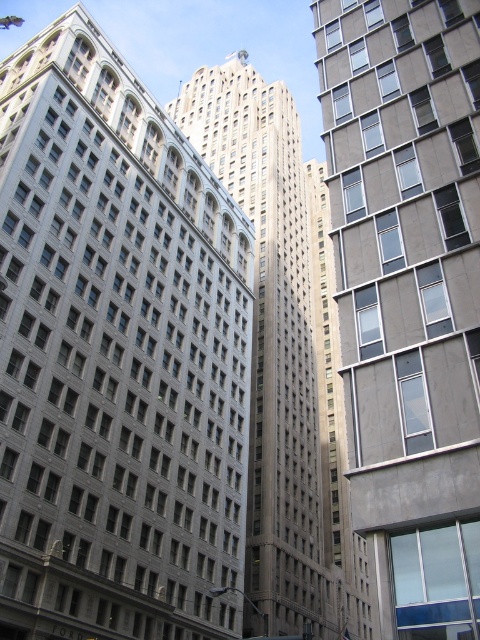
Question: Considering the relative positions of gray stone building at center and gray stone skyscraper at center in the image provided, where is gray stone building at center located with respect to gray stone skyscraper at center?

Choices:
 (A) above
 (B) below

Answer: (B)

Question: Which point is farther from the camera taking this photo?

Choices:
 (A) (465, 589)
 (B) (127, 227)

Answer: (B)

Question: In this image, where is gray stone building at center located relative to gray stone skyscraper at center?

Choices:
 (A) left
 (B) right

Answer: (A)

Question: Is gray stone building at center bigger than gray stone skyscraper at center?

Choices:
 (A) no
 (B) yes

Answer: (A)

Question: Which point is farther to the camera?

Choices:
 (A) (118, 269)
 (B) (360, 224)
 (C) (253, 378)

Answer: (C)

Question: Which is nearer to the gray stone skyscraper at center?

Choices:
 (A) gray stone building at center
 (B) gray concrete building at right

Answer: (A)